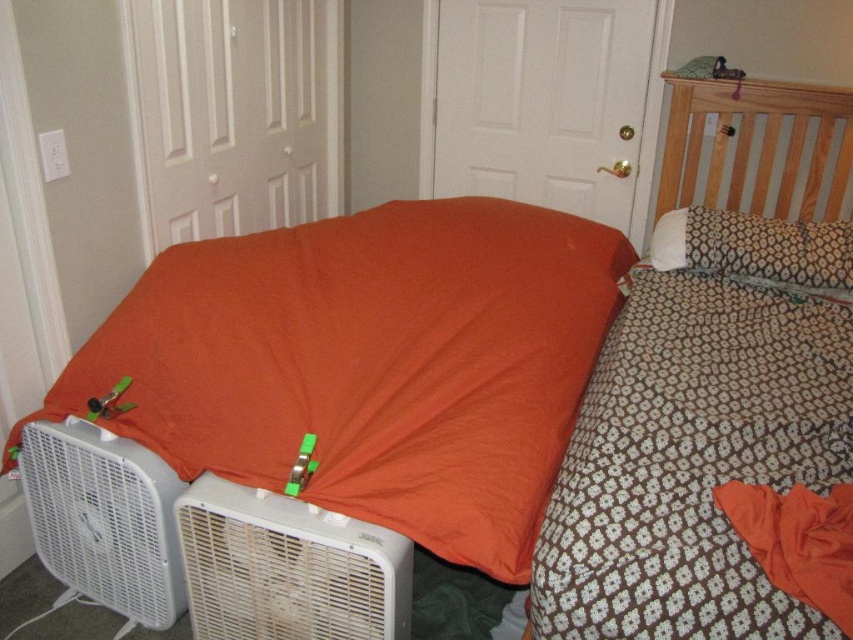
Does brown printed fabric bed at upper right appear over white plastic air conditioner at lower left?

Indeed, brown printed fabric bed at upper right is positioned over white plastic air conditioner at lower left.

Who is shorter, brown printed fabric bed at upper right or white plastic air conditioner at lower left?

white plastic air conditioner at lower left is shorter.

In order to click on brown printed fabric bed at upper right in this screenshot , I will do `click(685, 440)`.

Locate an element on the screen. The width and height of the screenshot is (853, 640). brown printed fabric bed at upper right is located at coordinates (685, 440).

Does point (836, 349) lie in front of point (763, 257)?

Yes.

Does brown printed fabric bed at upper right have a greater width compared to white textured pillow at upper right?

Correct, the width of brown printed fabric bed at upper right exceeds that of white textured pillow at upper right.

I want to click on brown printed fabric bed at upper right, so click(685, 440).

The width and height of the screenshot is (853, 640). Identify the location of brown printed fabric bed at upper right. (685, 440).

Does brown printed fabric bed at upper right have a lesser height compared to white plastic fan at lower left?

Incorrect, brown printed fabric bed at upper right's height does not fall short of white plastic fan at lower left's.

Which is more to the right, brown printed fabric bed at upper right or white plastic fan at lower left?

brown printed fabric bed at upper right

Which is in front, point (660, 192) or point (103, 532)?

Point (103, 532)

Locate an element on the screen. The image size is (853, 640). brown printed fabric bed at upper right is located at coordinates (685, 440).